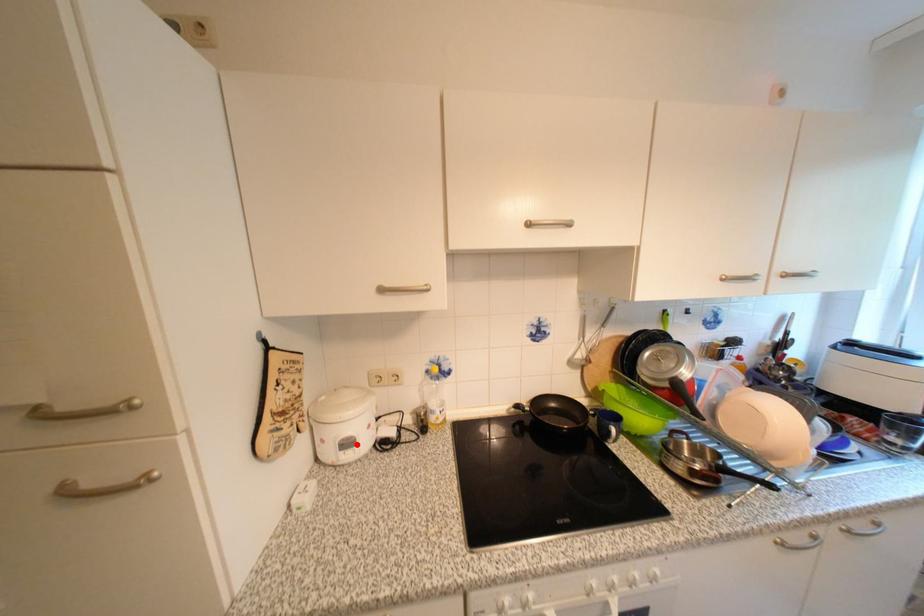
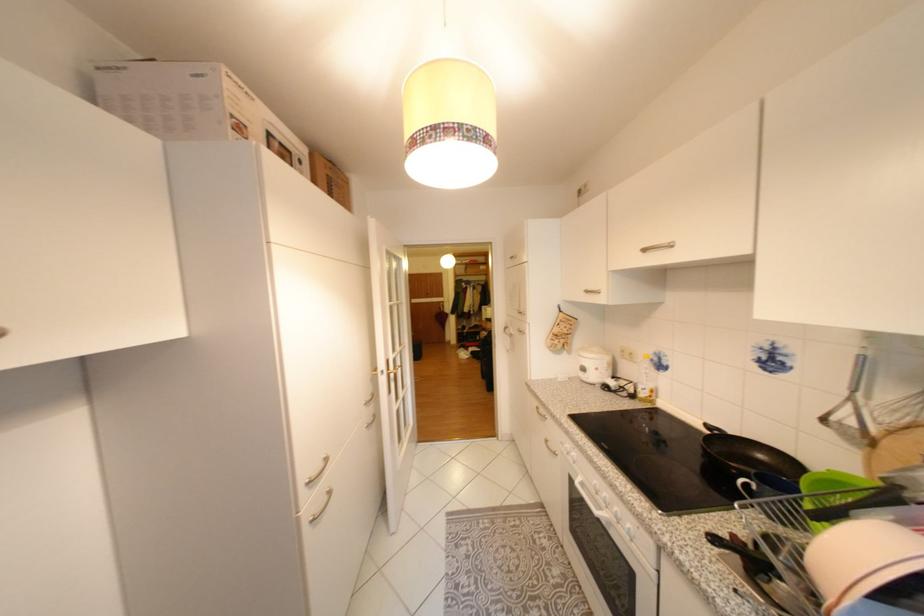
In the second image, find the point that corresponds to the highlighted location in the first image.

(592, 370)